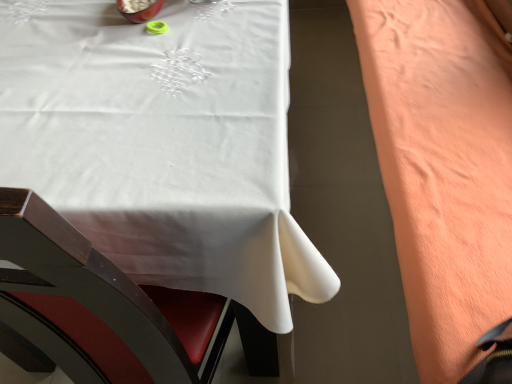
Identify the location of free space above coral fleece blanket at right (from a real-world perspective). (433, 108).